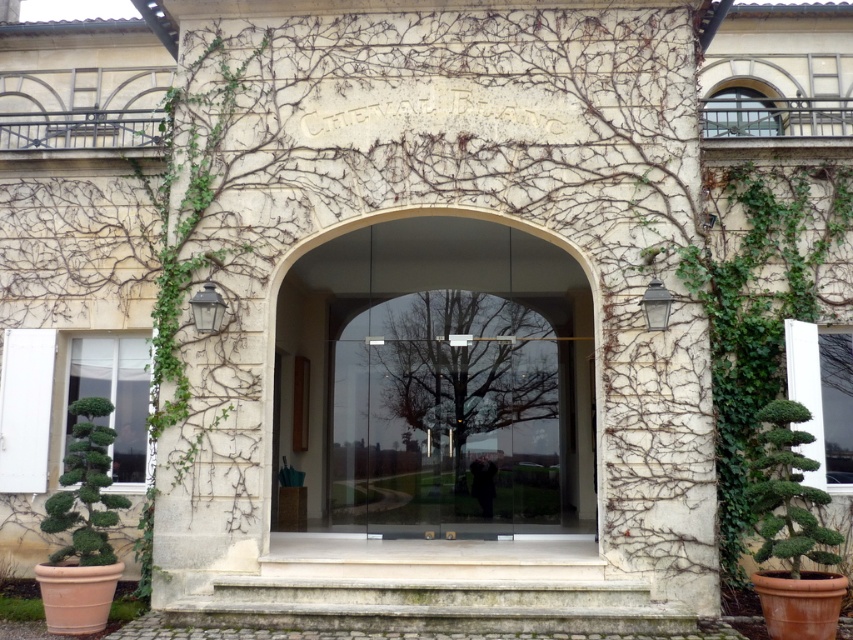
Who is higher up, green leafy bush at right or green leafy bush at lower left?

green leafy bush at right is higher up.

Can you confirm if green leafy bush at right is thinner than green leafy bush at lower left?

In fact, green leafy bush at right might be wider than green leafy bush at lower left.

At what (x,y) coordinates should I click in order to perform the action: click on green leafy bush at right. Please return your answer as a coordinate pair (x, y). The image size is (853, 640). Looking at the image, I should click on (786, 492).

Is the position of transparent glass door at center more distant than that of green leafy bush at right?

Yes, it is.

Does transparent glass door at center appear over green leafy bush at right?

Yes, transparent glass door at center is above green leafy bush at right.

What are the coordinates of `transparent glass door at center` in the screenshot? It's located at (434, 387).

Does transparent glass door at center come in front of green leafy bush at lower left?

No, it is not.

Based on the photo, does transparent glass door at center appear under green leafy bush at lower left?

No, transparent glass door at center is not below green leafy bush at lower left.

Locate an element on the screen. This screenshot has height=640, width=853. transparent glass door at center is located at coordinates (434, 387).